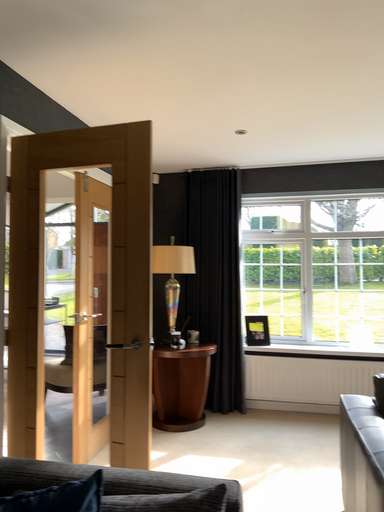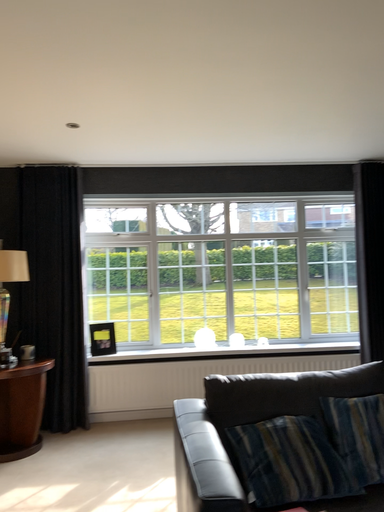
Question: How did the camera likely rotate when shooting the video?

Choices:
 (A) rotated left
 (B) rotated right

Answer: (B)